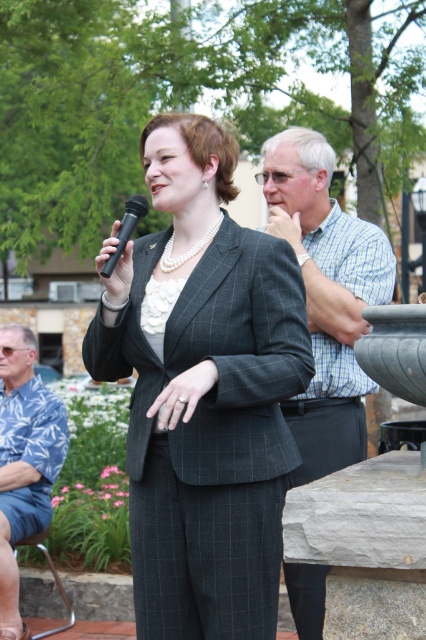
Who is shorter, checkered shirt at center or black plastic microphone at upper center?

With less height is black plastic microphone at upper center.

Between checkered shirt at center and black plastic microphone at upper center, which one appears on the left side from the viewer's perspective?

black plastic microphone at upper center

The height and width of the screenshot is (640, 426). What do you see at coordinates (325, 296) in the screenshot? I see `checkered shirt at center` at bounding box center [325, 296].

What are the coordinates of `checkered shirt at center` in the screenshot? It's located at (325, 296).

Who is positioned more to the left, matte gray suit at center or checkered shirt at center?

matte gray suit at center

How distant is matte gray suit at center from checkered shirt at center?

They are 3.87 feet apart.

Between point (175, 579) and point (367, 291), which one is positioned in front?

Point (175, 579)

You are a GUI agent. You are given a task and a screenshot of the screen. Output one action in this format:
    pyautogui.click(x=<x>, y=<y>)
    Task: Click on the matte gray suit at center
    
    Given the screenshot: What is the action you would take?
    pyautogui.click(x=204, y=392)

Who is taller, matte gray suit at center or blue floral shirt at left?

Standing taller between the two is matte gray suit at center.

Which is behind, point (204, 316) or point (11, 396)?

Positioned behind is point (11, 396).

Does point (190, 115) come farther from viewer compared to point (8, 324)?

That is False.

Image resolution: width=426 pixels, height=640 pixels. Identify the location of matte gray suit at center. pos(204,392).